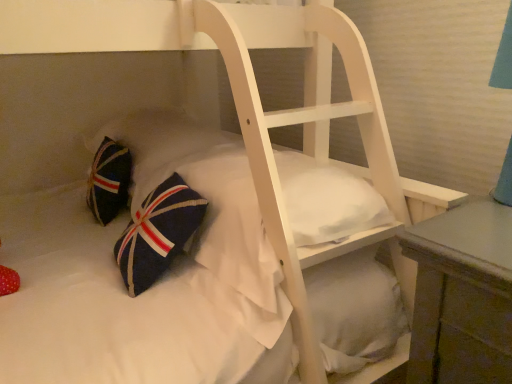
The height and width of the screenshot is (384, 512). What are the coordinates of `navy blue fabric pillow at lower left` in the screenshot? It's located at (159, 145).

What do you see at coordinates (159, 145) in the screenshot? This screenshot has height=384, width=512. I see `navy blue fabric pillow at lower left` at bounding box center [159, 145].

In order to click on navy blue fabric pillow at lower left in this screenshot , I will do [132, 304].

Measure the distance between navy blue fabric pillow at lower left and camera.

navy blue fabric pillow at lower left and camera are 28.59 inches apart.

Image resolution: width=512 pixels, height=384 pixels. Describe the element at coordinates (132, 304) in the screenshot. I see `navy blue fabric pillow at lower left` at that location.

Locate an element on the screen. The width and height of the screenshot is (512, 384). navy blue fabric pillow at lower left is located at coordinates (159, 145).

Is navy blue fabric pillow at lower left to the right of navy blue fabric pillow at lower left from the viewer's perspective?

No.

Who is more distant, navy blue fabric pillow at lower left or navy blue fabric pillow at lower left?

navy blue fabric pillow at lower left.

Is point (99, 206) less distant than point (254, 380)?

No.

From the image's perspective, between navy blue fabric pillow at lower left and navy blue fabric pillow at lower left, who is located below?

navy blue fabric pillow at lower left.

From a real-world perspective, who is located lower, navy blue fabric pillow at lower left or navy blue fabric pillow at lower left?

In real-world perspective, navy blue fabric pillow at lower left is lower.

Considering the sizes of objects navy blue fabric pillow at lower left and navy blue fabric pillow at lower left in the image provided, who is wider, navy blue fabric pillow at lower left or navy blue fabric pillow at lower left?

navy blue fabric pillow at lower left.

Based on the photo, does navy blue fabric pillow at lower left have a lesser height compared to navy blue fabric pillow at lower left?

Correct, navy blue fabric pillow at lower left is not as tall as navy blue fabric pillow at lower left.

Between navy blue fabric pillow at lower left and navy blue fabric pillow at lower left, which one has larger size?

navy blue fabric pillow at lower left is bigger.

Is navy blue fabric pillow at lower left surrounded by navy blue fabric pillow at lower left?

No, navy blue fabric pillow at lower left does not contain navy blue fabric pillow at lower left.

Is navy blue fabric pillow at lower left far from navy blue fabric pillow at lower left?

No, navy blue fabric pillow at lower left is in close proximity to navy blue fabric pillow at lower left.

Looking at this image, is navy blue fabric pillow at lower left turned away from navy blue fabric pillow at lower left?

No, navy blue fabric pillow at lower left is not facing away from navy blue fabric pillow at lower left.

What's the angular difference between navy blue fabric pillow at lower left and navy blue fabric pillow at lower left's facing directions?

navy blue fabric pillow at lower left and navy blue fabric pillow at lower left are facing 0.925 degrees away from each other.

Measure the distance between navy blue fabric pillow at lower left and navy blue fabric pillow at lower left.

navy blue fabric pillow at lower left and navy blue fabric pillow at lower left are 15.62 inches apart from each other.

You are a GUI agent. You are given a task and a screenshot of the screen. Output one action in this format:
    pyautogui.click(x=<x>, y=<y>)
    Task: Click on the pillow positioned vertically above the navy blue fabric pillow at lower left (from a real-world perspective)
    This screenshot has width=512, height=384.
    Given the screenshot: What is the action you would take?
    pyautogui.click(x=159, y=145)

Considering the relative positions of navy blue fabric pillow at lower left and navy blue fabric pillow at lower left in the image provided, is navy blue fabric pillow at lower left to the left of navy blue fabric pillow at lower left from the viewer's perspective?

Incorrect, navy blue fabric pillow at lower left is not on the left side of navy blue fabric pillow at lower left.

Between navy blue fabric pillow at lower left and navy blue fabric pillow at lower left, which one is positioned behind?

navy blue fabric pillow at lower left is more distant.

Is point (38, 358) positioned before point (156, 135)?

Yes.

From the image's perspective, which one is positioned lower, navy blue fabric pillow at lower left or navy blue fabric pillow at lower left?

navy blue fabric pillow at lower left appears lower in the image.

From a real-world perspective, which is physically above, navy blue fabric pillow at lower left or navy blue fabric pillow at lower left?

navy blue fabric pillow at lower left, from a real-world perspective.

Does navy blue fabric pillow at lower left have a lesser width compared to navy blue fabric pillow at lower left?

Indeed, navy blue fabric pillow at lower left has a lesser width compared to navy blue fabric pillow at lower left.

Considering the sizes of navy blue fabric pillow at lower left and navy blue fabric pillow at lower left in the image, is navy blue fabric pillow at lower left taller or shorter than navy blue fabric pillow at lower left?

In the image, navy blue fabric pillow at lower left appears to be taller than navy blue fabric pillow at lower left.

Is navy blue fabric pillow at lower left bigger than navy blue fabric pillow at lower left?

Actually, navy blue fabric pillow at lower left might be smaller than navy blue fabric pillow at lower left.

Can we say navy blue fabric pillow at lower left lies outside navy blue fabric pillow at lower left?

Yes, navy blue fabric pillow at lower left is not within navy blue fabric pillow at lower left.

Is navy blue fabric pillow at lower left in contact with navy blue fabric pillow at lower left?

navy blue fabric pillow at lower left and navy blue fabric pillow at lower left are clearly separated.

Is navy blue fabric pillow at lower left facing towards navy blue fabric pillow at lower left?

No, navy blue fabric pillow at lower left is not oriented towards navy blue fabric pillow at lower left.

Can you tell me how much navy blue fabric pillow at lower left and navy blue fabric pillow at lower left differ in facing direction?

0.925 degrees separate the facing orientations of navy blue fabric pillow at lower left and navy blue fabric pillow at lower left.

In order to click on mattress in front of the navy blue fabric pillow at lower left in this screenshot , I will do `click(132, 304)`.

What are the coordinates of `mattress directly beneath the navy blue fabric pillow at lower left (from a real-world perspective)` in the screenshot? It's located at (132, 304).

Locate an element on the screen. pillow that appears above the navy blue fabric pillow at lower left (from the image's perspective) is located at coordinates (159, 145).